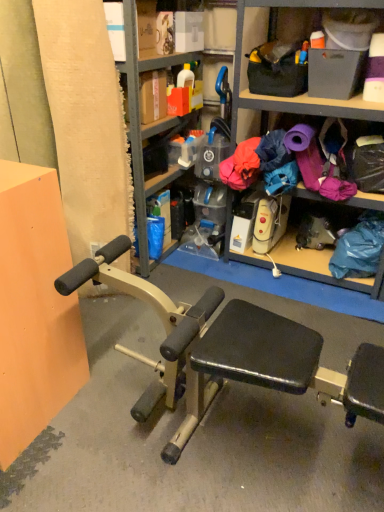
Question: From the image's perspective, relative to purple fabric at center, is metallic gray bookshelf at upper center above or below?

Choices:
 (A) above
 (B) below

Answer: (A)

Question: Considering the positions of point (134, 57) and point (238, 186), is point (134, 57) closer or farther from the camera than point (238, 186)?

Choices:
 (A) closer
 (B) farther

Answer: (A)

Question: Would you say metallic gray bookshelf at upper center is inside or outside purple fabric at center?

Choices:
 (A) outside
 (B) inside

Answer: (A)

Question: From a real-world perspective, relative to metallic gray bookshelf at upper center, is purple fabric at center vertically above or below?

Choices:
 (A) above
 (B) below

Answer: (B)

Question: Considering the positions of purple fabric at center and metallic gray bookshelf at upper center in the image, is purple fabric at center wider or thinner than metallic gray bookshelf at upper center?

Choices:
 (A) wide
 (B) thin

Answer: (A)

Question: Would you say purple fabric at center is inside or outside metallic gray bookshelf at upper center?

Choices:
 (A) inside
 (B) outside

Answer: (B)

Question: Looking at the image, does purple fabric at center seem bigger or smaller compared to metallic gray bookshelf at upper center?

Choices:
 (A) small
 (B) big

Answer: (A)